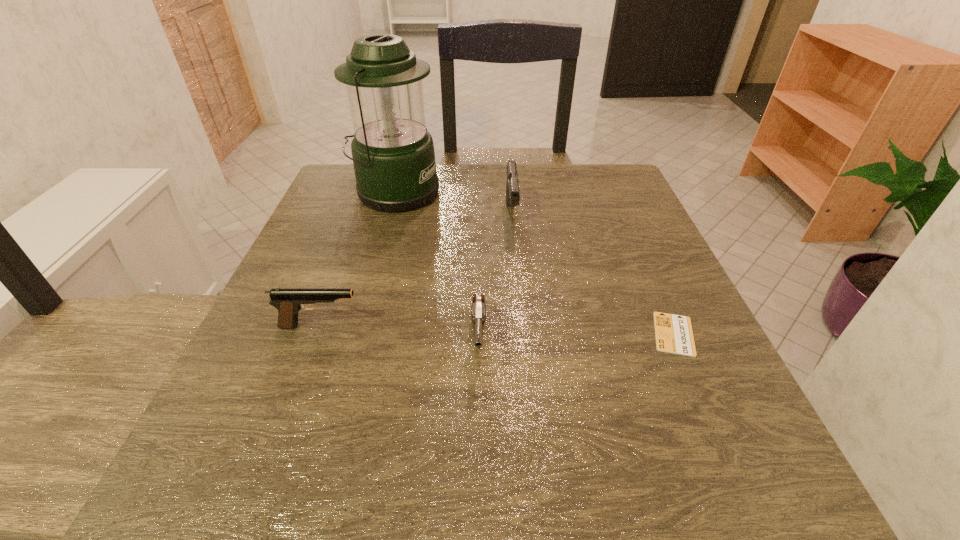
Find the location of `free space at the left edge`. free space at the left edge is located at coordinates pyautogui.click(x=333, y=222).

Identify the location of vacant point at the right edge. (639, 258).

In order to click on free space at the near left corner of the desktop in this screenshot , I will do `click(250, 485)`.

This screenshot has height=540, width=960. I want to click on free space at the far right corner of the desktop, so click(x=566, y=180).

The height and width of the screenshot is (540, 960). In the image, there is a desktop. Identify the location of vacant space at the near right corner. (669, 463).

Locate an element on the screen. The height and width of the screenshot is (540, 960). unoccupied area between the leftmost pistol and the tallest pistol is located at coordinates [416, 271].

Where is `vacant point located between the leftmost pistol and the rightmost pistol`? The width and height of the screenshot is (960, 540). vacant point located between the leftmost pistol and the rightmost pistol is located at coordinates (416, 271).

Locate an element on the screen. free space between the leftmost pistol and the rightmost object is located at coordinates (497, 329).

I want to click on free spot between the leftmost pistol and the rightmost object, so click(497, 329).

Where is `free space between the third object from left to right and the tallest pistol`? Image resolution: width=960 pixels, height=540 pixels. free space between the third object from left to right and the tallest pistol is located at coordinates (495, 279).